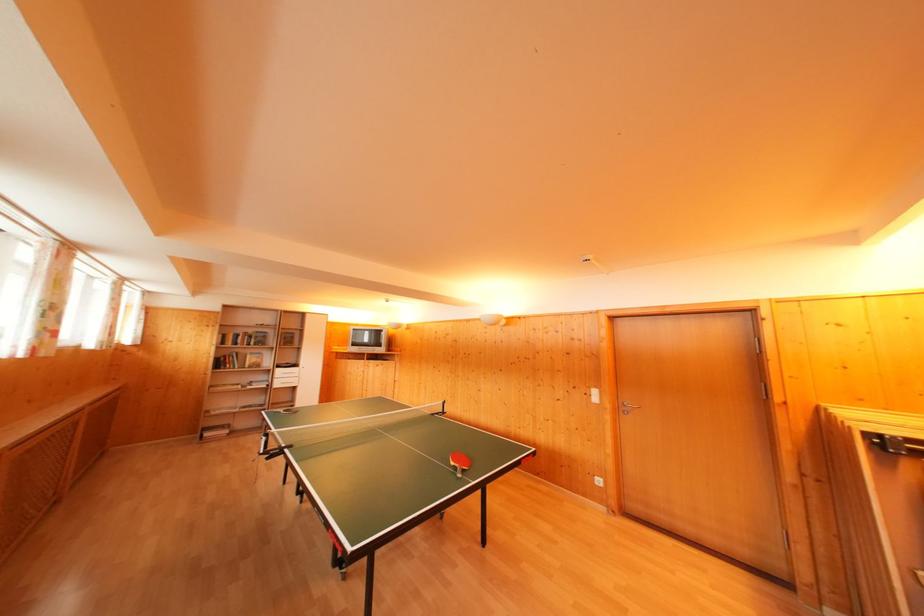
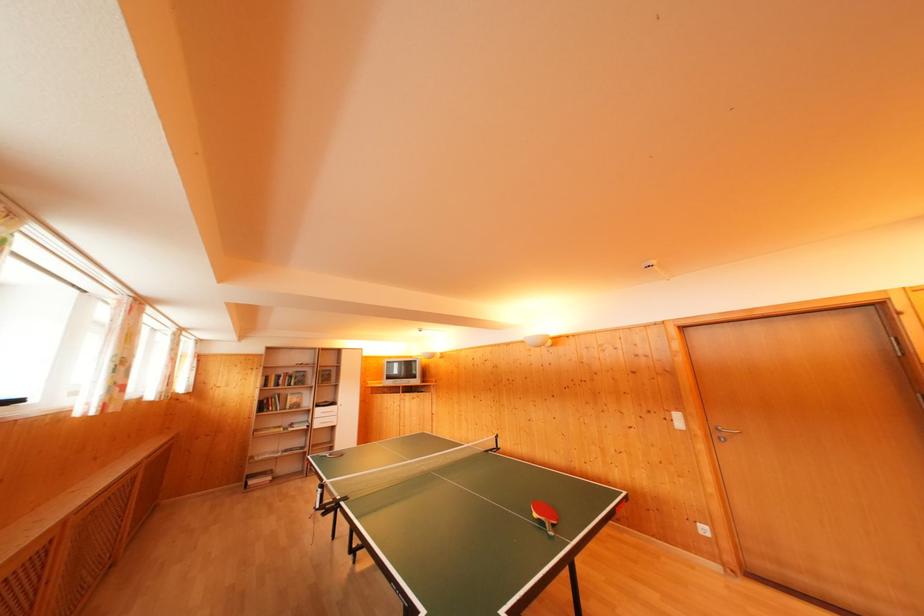
Where in the second image is the point corresponding to point 457,468 from the first image?

(541, 521)